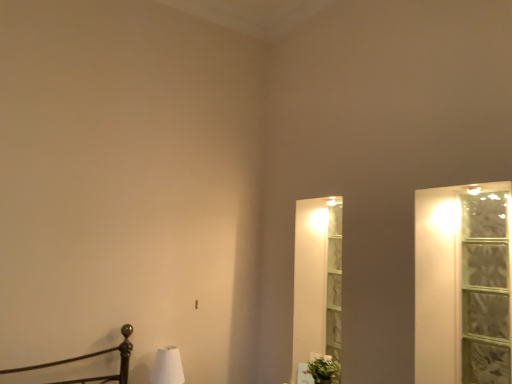
Question: Is clear glass window at right next to white matte table lamp at lower left?

Choices:
 (A) yes
 (B) no

Answer: (B)

Question: From the image's perspective, is clear glass window at right beneath white matte table lamp at lower left?

Choices:
 (A) no
 (B) yes

Answer: (A)

Question: Considering the relative sizes of clear glass window at right and white matte table lamp at lower left in the image provided, is clear glass window at right taller than white matte table lamp at lower left?

Choices:
 (A) no
 (B) yes

Answer: (B)

Question: Is white matte table lamp at lower left inside clear glass window at right?

Choices:
 (A) no
 (B) yes

Answer: (A)

Question: Does clear glass window at right come in front of white matte table lamp at lower left?

Choices:
 (A) no
 (B) yes

Answer: (B)

Question: Looking at their shapes, would you say green leafy plant at lower right is wider or thinner than white matte table lamp at lower left?

Choices:
 (A) thin
 (B) wide

Answer: (A)

Question: Looking at the image, does green leafy plant at lower right seem bigger or smaller compared to white matte table lamp at lower left?

Choices:
 (A) big
 (B) small

Answer: (B)

Question: Does point (325, 367) appear closer or farther from the camera than point (181, 380)?

Choices:
 (A) farther
 (B) closer

Answer: (B)

Question: Considering the relative positions of green leafy plant at lower right and white matte table lamp at lower left in the image provided, is green leafy plant at lower right to the left or to the right of white matte table lamp at lower left?

Choices:
 (A) left
 (B) right

Answer: (B)

Question: Would you say white matte table lamp at lower left is to the left or to the right of green leafy plant at lower right in the picture?

Choices:
 (A) left
 (B) right

Answer: (A)

Question: From the image's perspective, is white matte table lamp at lower left positioned above or below green leafy plant at lower right?

Choices:
 (A) below
 (B) above

Answer: (B)

Question: Is white matte table lamp at lower left wider or thinner than green leafy plant at lower right?

Choices:
 (A) wide
 (B) thin

Answer: (A)

Question: From a real-world perspective, relative to green leafy plant at lower right, is white matte table lamp at lower left vertically above or below?

Choices:
 (A) above
 (B) below

Answer: (A)

Question: In terms of size, does white matte table lamp at lower left appear bigger or smaller than clear glass window at right?

Choices:
 (A) small
 (B) big

Answer: (A)

Question: In the image, is white matte table lamp at lower left on the left side or the right side of clear glass window at right?

Choices:
 (A) left
 (B) right

Answer: (A)